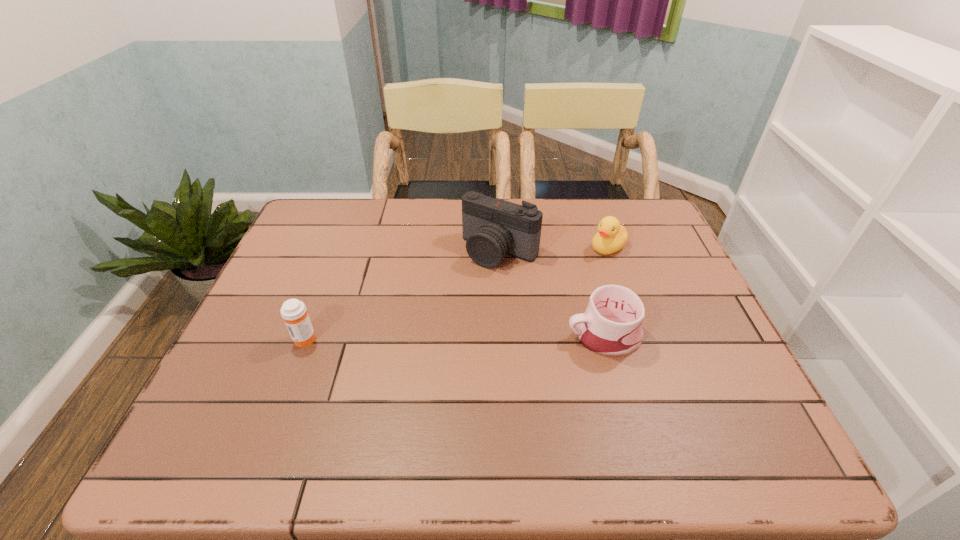
I want to click on medicine, so click(293, 311).

This screenshot has height=540, width=960. What are the coordinates of `mug` in the screenshot? It's located at (611, 326).

Identify the location of duckling. (611, 237).

You are a GUI agent. You are given a task and a screenshot of the screen. Output one action in this format:
    pyautogui.click(x=<x>, y=<y>)
    Task: Click on the camera
    The height and width of the screenshot is (540, 960).
    Given the screenshot: What is the action you would take?
    pyautogui.click(x=492, y=228)

This screenshot has height=540, width=960. In order to click on the second object from left to right in this screenshot , I will do `click(492, 228)`.

Where is `vacant space located 0.060m on the front of the medicine`? The height and width of the screenshot is (540, 960). vacant space located 0.060m on the front of the medicine is located at coordinates (293, 369).

Where is `free spot located on the side with the handle of the mug`? Image resolution: width=960 pixels, height=540 pixels. free spot located on the side with the handle of the mug is located at coordinates (462, 335).

Where is `vacant space located on the side with the handle of the mug`? vacant space located on the side with the handle of the mug is located at coordinates (516, 335).

The image size is (960, 540). In order to click on vacant area situated on the side with the handle of the mug in this screenshot , I will do `click(533, 335)`.

Find the location of `vacant point located 0.180m on the face of the duckling`. vacant point located 0.180m on the face of the duckling is located at coordinates (551, 279).